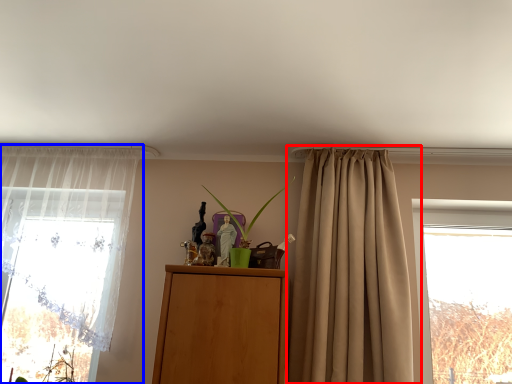
Question: Among these objects, which one is nearest to the camera, curtain (highlighted by a red box) or curtain (highlighted by a blue box)?

Choices:
 (A) curtain
 (B) curtain

Answer: (A)